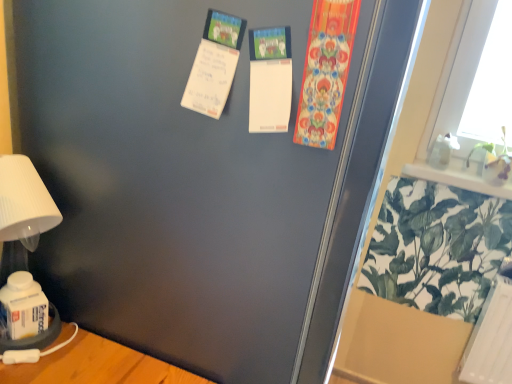
Question: Is green leafy plant at upper right, which appears as the 2th plant when ordered from the bottom, facing towards transparent plastic screen door at upper right?

Choices:
 (A) yes
 (B) no

Answer: (B)

Question: From the image's perspective, is green leafy plant at upper right, which ranks as the 1th plant in top-to-bottom order, below transparent plastic screen door at upper right?

Choices:
 (A) yes
 (B) no

Answer: (B)

Question: Is green leafy plant at upper right, which ranks as the 1th plant in top-to-bottom order, next to transparent plastic screen door at upper right?

Choices:
 (A) yes
 (B) no

Answer: (B)

Question: Is green leafy plant at upper right, which appears as the 2th plant when ordered from the bottom, thinner than transparent plastic screen door at upper right?

Choices:
 (A) yes
 (B) no

Answer: (A)

Question: Can we say green leafy plant at upper right, which ranks as the 1th plant in top-to-bottom order, lies outside transparent plastic screen door at upper right?

Choices:
 (A) yes
 (B) no

Answer: (A)

Question: From a real-world perspective, is green leafy plant at upper right, which appears as the 2th plant when ordered from the bottom, below transparent plastic screen door at upper right?

Choices:
 (A) no
 (B) yes

Answer: (A)

Question: From the image's perspective, is white matte table lamp at lower left located beneath white paper postcard at upper center, placed as the second postcard when sorted from right to left?

Choices:
 (A) no
 (B) yes

Answer: (B)

Question: Are white matte table lamp at lower left and white paper postcard at upper center, which is the first postcard from left to right, far apart?

Choices:
 (A) yes
 (B) no

Answer: (B)

Question: Considering the relative sizes of white matte table lamp at lower left and white paper postcard at upper center, which is the first postcard from left to right, in the image provided, is white matte table lamp at lower left bigger than white paper postcard at upper center, which is the first postcard from left to right,?

Choices:
 (A) no
 (B) yes

Answer: (B)

Question: Is white matte table lamp at lower left closer to the viewer compared to white paper postcard at upper center, placed as the second postcard when sorted from right to left?

Choices:
 (A) yes
 (B) no

Answer: (B)

Question: Can we say white matte table lamp at lower left lies outside white paper postcard at upper center, placed as the second postcard when sorted from right to left?

Choices:
 (A) yes
 (B) no

Answer: (A)

Question: Can you confirm if white matte table lamp at lower left is wider than white paper postcard at upper center, placed as the second postcard when sorted from right to left?

Choices:
 (A) no
 (B) yes

Answer: (B)

Question: Does green leafy plant at lower right, the first plant when ordered from bottom to top, lie behind transparent plastic screen door at upper right?

Choices:
 (A) yes
 (B) no

Answer: (A)